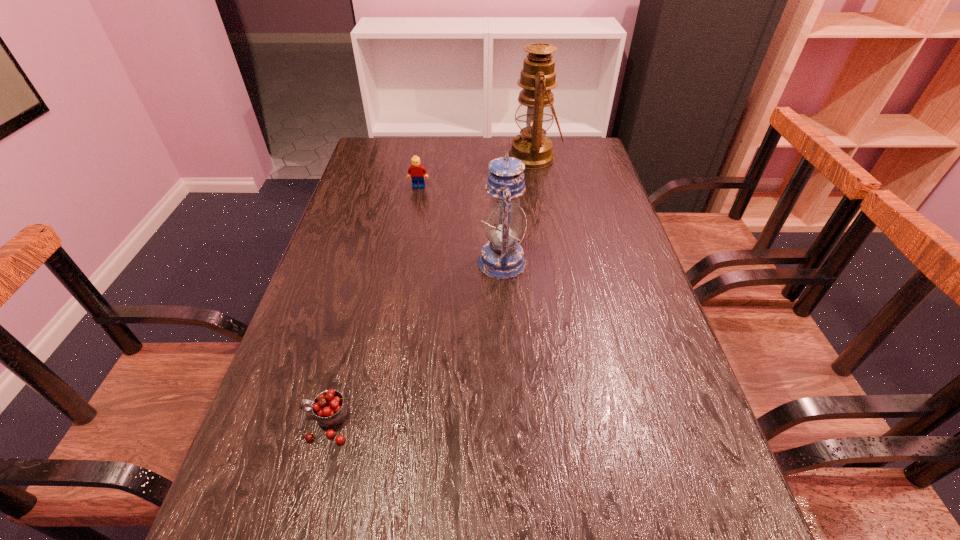
Find the location of a particular element. The height and width of the screenshot is (540, 960). free space located on the front-facing side of the third shortest object is located at coordinates (435, 262).

You are a GUI agent. You are given a task and a screenshot of the screen. Output one action in this format:
    pyautogui.click(x=<x>, y=<y>)
    Task: Click on the vacant region located on the front-facing side of the third shortest object
    The height and width of the screenshot is (540, 960).
    Given the screenshot: What is the action you would take?
    pyautogui.click(x=396, y=262)

In order to click on blank area located 0.100m on the front-facing side of the second farthest object in this screenshot , I will do `click(415, 207)`.

This screenshot has width=960, height=540. Identify the location of vacant area situated on the handle side of the cherry. (259, 423).

Identify the location of object that is positioned at the far edge. [x=535, y=109].

The image size is (960, 540). I want to click on object located in the left edge section of the desktop, so click(x=330, y=409).

Find the location of a particular element. The height and width of the screenshot is (540, 960). object that is at the right edge is located at coordinates (535, 109).

This screenshot has height=540, width=960. I want to click on object at the far right corner, so click(535, 109).

In the image, there is a desktop. In order to click on free space at the far edge in this screenshot , I will do `click(449, 147)`.

In the image, there is a desktop. Find the location of `free space at the left edge`. free space at the left edge is located at coordinates (365, 175).